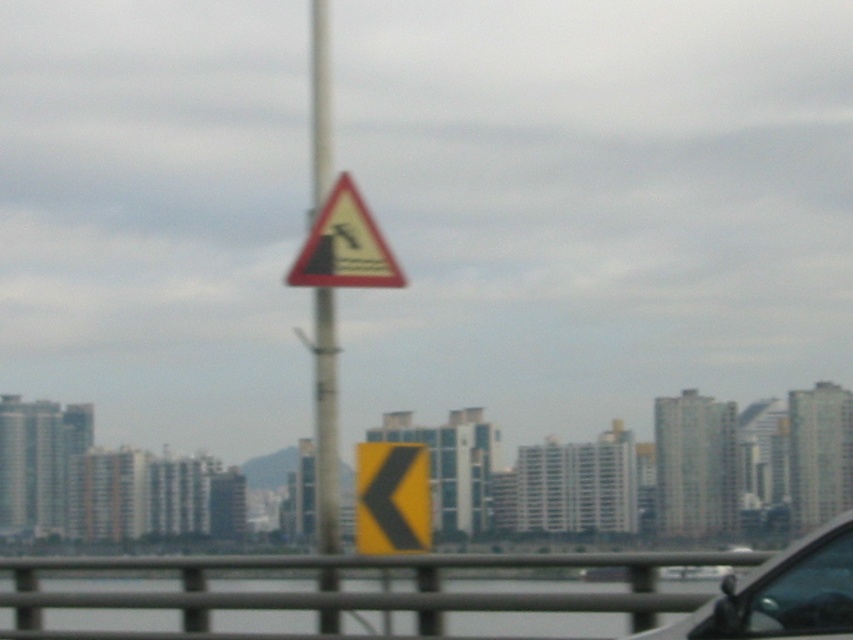
Question: Estimate the real-world distances between objects in this image. Which object is closer to the yellow matte arrow at center?

Choices:
 (A) metallic gray car at lower right
 (B) yellow triangular warning sign at center

Answer: (B)

Question: Based on their relative distances, which object is nearer to the yellow triangular warning sign at center?

Choices:
 (A) yellow matte arrow at center
 (B) metallic gray car at lower right

Answer: (A)

Question: Is metallic gray car at lower right smaller than yellow triangular warning sign at center?

Choices:
 (A) no
 (B) yes

Answer: (B)

Question: In this image, where is yellow matte arrow at center located relative to yellow triangular warning sign at center?

Choices:
 (A) below
 (B) above

Answer: (A)

Question: Which object is positioned closest to the yellow triangular warning sign at center?

Choices:
 (A) yellow matte arrow at center
 (B) metallic gray car at lower right

Answer: (A)

Question: Considering the relative positions of yellow matte arrow at center and yellow triangular warning sign at center in the image provided, where is yellow matte arrow at center located with respect to yellow triangular warning sign at center?

Choices:
 (A) left
 (B) right

Answer: (B)